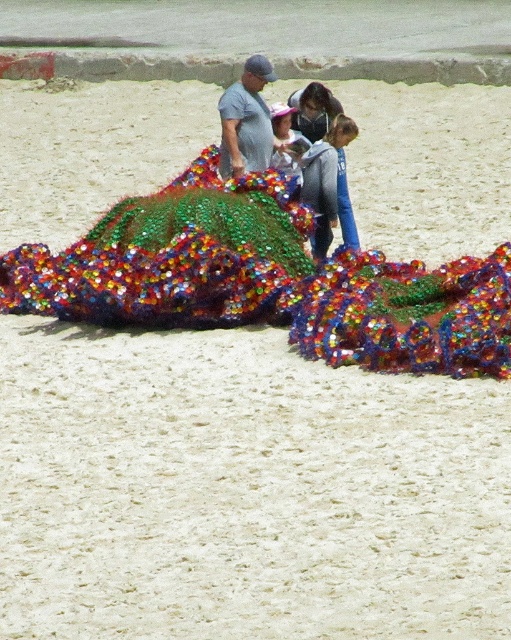
Consider the image. How distant is shiny plastic blanket at center from matte blue shirt at upper center?

shiny plastic blanket at center is 3.75 meters from matte blue shirt at upper center.

Does shiny plastic blanket at center appear over matte blue shirt at upper center?

Incorrect, shiny plastic blanket at center is not positioned above matte blue shirt at upper center.

Between point (405, 332) and point (296, 112), which one is positioned behind?

The point (296, 112) is more distant.

At what (x,y) coordinates should I click in order to perform the action: click on shiny plastic blanket at center. Please return your answer as a coordinate pair (x, y). The height and width of the screenshot is (640, 511). Looking at the image, I should click on (267, 280).

Who is positioned more to the left, shiny metallic blanket at center or matte blue shirt at upper center?

From the viewer's perspective, shiny metallic blanket at center appears more on the left side.

Between point (141, 289) and point (315, 131), which one is positioned behind?

The point (315, 131) is behind.

This screenshot has height=640, width=511. I want to click on shiny metallic blanket at center, so click(174, 257).

Between point (315, 125) and point (300, 186), which one is positioned behind?

Point (315, 125)

Can you confirm if matte blue shirt at upper center is positioned to the left of matte pink hat at center?

In fact, matte blue shirt at upper center is to the right of matte pink hat at center.

Is point (300, 90) less distant than point (296, 160)?

No, it is not.

The height and width of the screenshot is (640, 511). What are the coordinates of `matte blue shirt at upper center` in the screenshot? It's located at (313, 109).